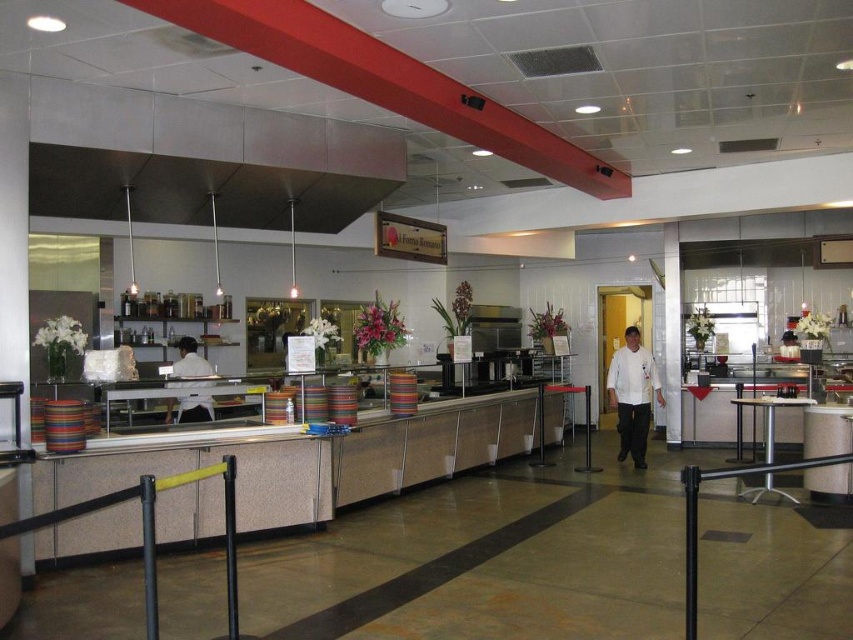
Question: Which object is closer to the camera taking this photo?

Choices:
 (A) white chef coat at center
 (B) white shirt at center

Answer: (B)

Question: Considering the relative positions of white chef coat at center and white shirt at center in the image provided, where is white chef coat at center located with respect to white shirt at center?

Choices:
 (A) left
 (B) right

Answer: (B)

Question: Is white chef coat at center behind white shirt at center?

Choices:
 (A) no
 (B) yes

Answer: (B)

Question: Does white chef coat at center have a greater width compared to white shirt at center?

Choices:
 (A) yes
 (B) no

Answer: (A)

Question: Which object appears farthest from the camera in this image?

Choices:
 (A) white chef coat at center
 (B) white shirt at center

Answer: (A)

Question: Which object appears farthest from the camera in this image?

Choices:
 (A) white chef coat at center
 (B) white shirt at center

Answer: (A)